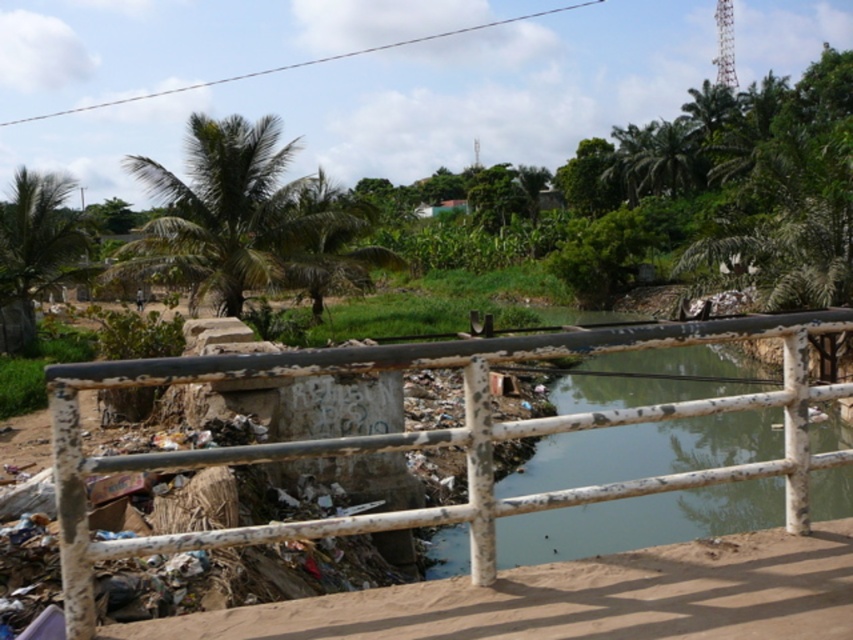
Is green leafy palm tree at upper left bigger than green leafy palm tree at upper right?

Actually, green leafy palm tree at upper left might be smaller than green leafy palm tree at upper right.

Is green leafy palm tree at upper left wider than green leafy palm tree at upper right?

No.

The height and width of the screenshot is (640, 853). Find the location of `green leafy palm tree at upper left`. green leafy palm tree at upper left is located at coordinates (36, 252).

Who is positioned more to the right, green leafy palm tree at upper center or green leafy palm tree at upper right?

green leafy palm tree at upper right is more to the right.

Which is more to the left, green leafy palm tree at upper center or green leafy palm tree at upper right?

green leafy palm tree at upper center is more to the left.

Who is more forward, (x=173, y=212) or (x=677, y=148)?

Point (x=173, y=212)

I want to click on green leafy palm tree at upper center, so click(245, 218).

How distant is white painted metal rail at center from green leafy palm tree at upper right?

A distance of 69.59 meters exists between white painted metal rail at center and green leafy palm tree at upper right.

Who is more forward, (x=80, y=380) or (x=688, y=180)?

Point (x=80, y=380) is in front.

Identify the location of white painted metal rail at center. 431,436.

Identify the location of white painted metal rail at center. The height and width of the screenshot is (640, 853). (431, 436).